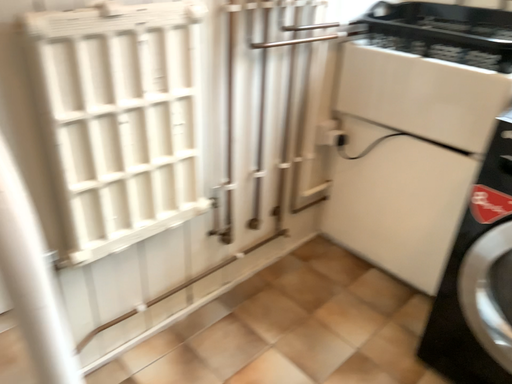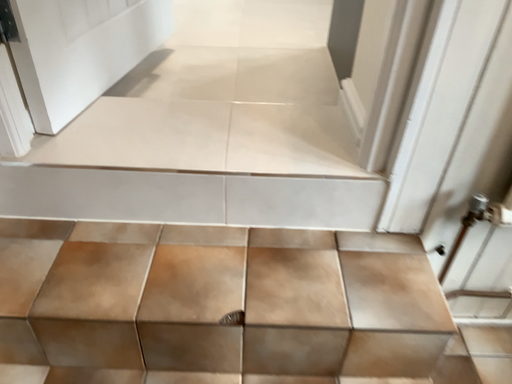
Question: Which way did the camera rotate in the video?

Choices:
 (A) rotated right
 (B) rotated left

Answer: (B)